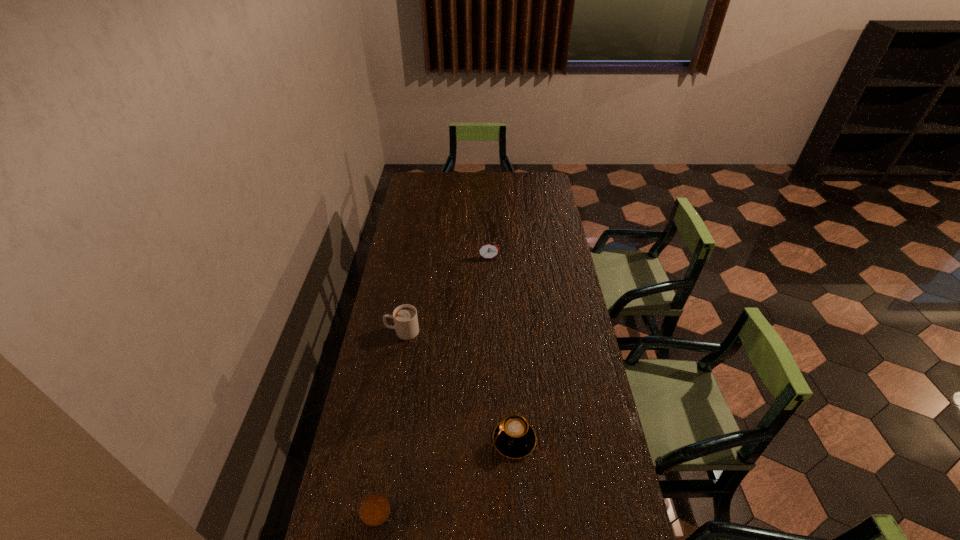
You are a GUI agent. You are given a task and a screenshot of the screen. Output one action in this format:
    pyautogui.click(x=<x>, y=<y>)
    Task: Click on the alarm clock
    
    Given the screenshot: What is the action you would take?
    pyautogui.click(x=488, y=250)

This screenshot has width=960, height=540. What are the coordinates of `the third nearest object` in the screenshot? It's located at (405, 317).

The image size is (960, 540). In order to click on the tallest cappuccino in this screenshot , I will do `click(405, 317)`.

At what (x,y) coordinates should I click in order to perform the action: click on the rightmost cappuccino. Please return your answer as a coordinate pair (x, y). The width and height of the screenshot is (960, 540). Looking at the image, I should click on (514, 438).

Image resolution: width=960 pixels, height=540 pixels. What are the coordinates of `the second nearest cappuccino` in the screenshot? It's located at (514, 438).

Locate an element on the screen. free location located 0.130m on the clock face of the alarm clock is located at coordinates (489, 280).

This screenshot has width=960, height=540. Find the location of `vacant space situated 0.130m on the right of the third farthest object`. vacant space situated 0.130m on the right of the third farthest object is located at coordinates (578, 440).

Where is `object located at the left edge`? The width and height of the screenshot is (960, 540). object located at the left edge is located at coordinates (405, 317).

Identify the location of vacant space at the far edge of the desktop. This screenshot has width=960, height=540. (478, 183).

You are a GUI agent. You are given a task and a screenshot of the screen. Output one action in this format:
    pyautogui.click(x=<x>, y=<y>)
    Task: Click on the free space at the left edge of the desktop
    Image resolution: width=960 pixels, height=540 pixels.
    Given the screenshot: What is the action you would take?
    (408, 216)